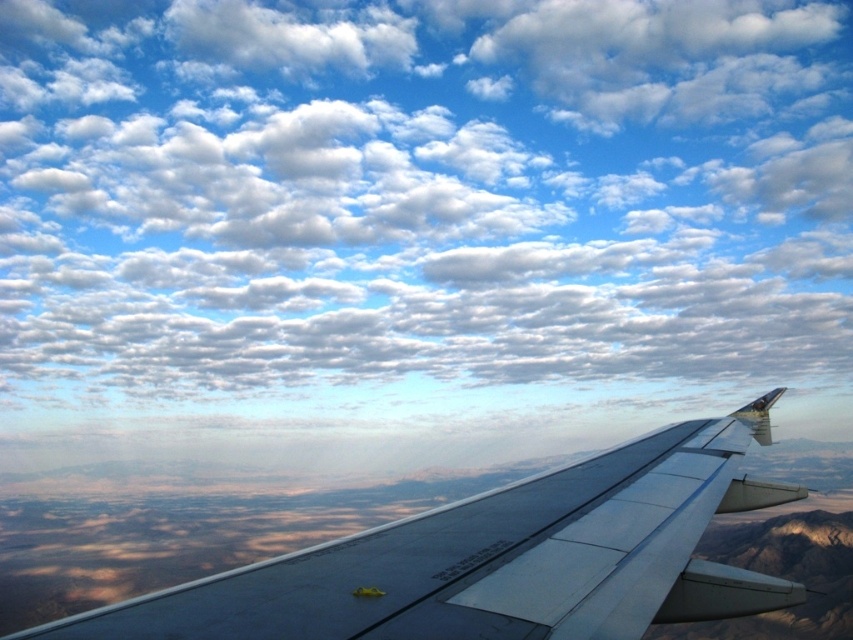
Question: Does white fluffy cloud at upper center have a greater width compared to metallic gray wing at center?

Choices:
 (A) yes
 (B) no

Answer: (A)

Question: Where is white fluffy cloud at upper center located in relation to metallic gray wing at center in the image?

Choices:
 (A) left
 (B) right

Answer: (A)

Question: Can you confirm if white fluffy cloud at upper center is positioned to the right of metallic gray wing at center?

Choices:
 (A) yes
 (B) no

Answer: (B)

Question: Which of the following is the closest to the observer?

Choices:
 (A) (433, 525)
 (B) (270, 333)

Answer: (A)

Question: Which of the following is the farthest from the observer?

Choices:
 (A) metallic gray wing at center
 (B) white fluffy cloud at upper center

Answer: (B)

Question: Which object is farther from the camera taking this photo?

Choices:
 (A) white fluffy cloud at upper center
 (B) metallic gray wing at center

Answer: (A)